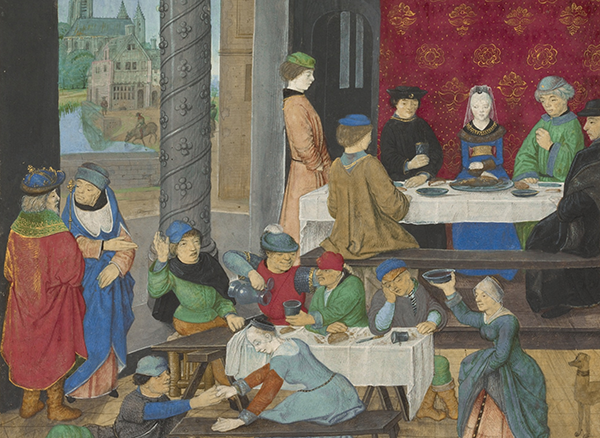
Locate an element on the screen. This screenshot has width=600, height=438. red royal curtain is located at coordinates (501, 66).